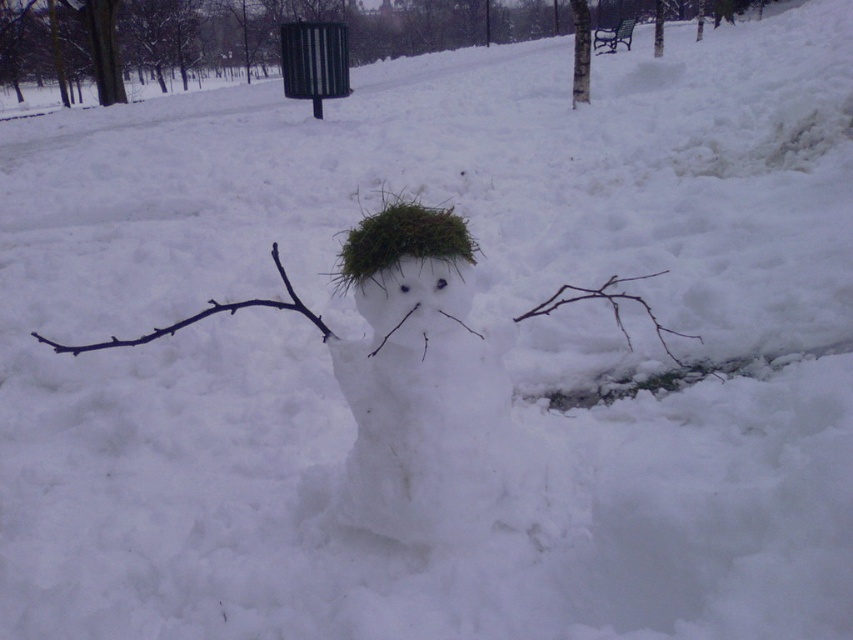
You are a child who wants to build a snowman just like the one in the image. You have a white fluffy snowman at center and a brown twig at lower right. Which object should you use as the arm for the snowman?

The brown twig at lower right should be used as the arm for the snowman because it is larger than the white fluffy snowman at center, making it suitable for the arms.